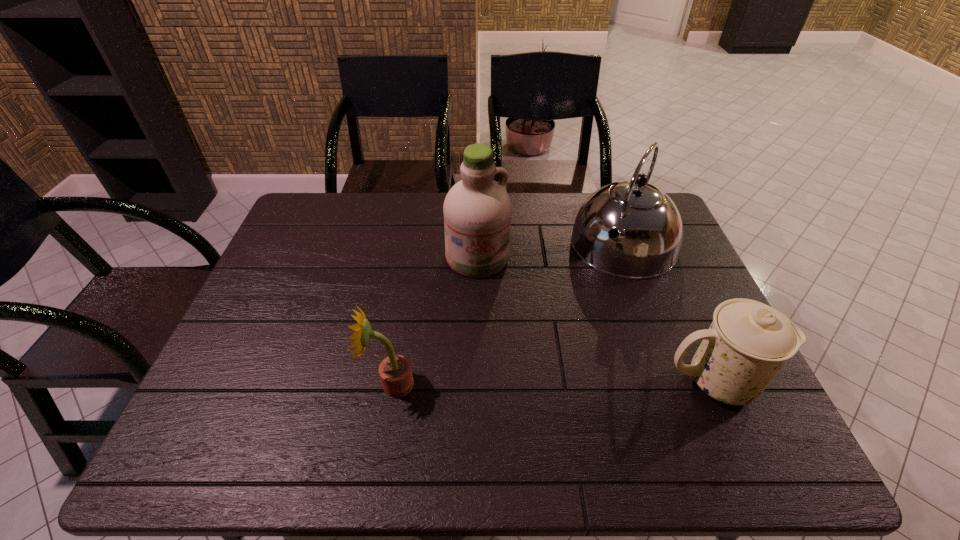
In order to click on empty location between the leftmost object and the chinaware in this screenshot , I will do tap(553, 383).

Where is `free space between the kettle and the third object from right to left`? This screenshot has height=540, width=960. free space between the kettle and the third object from right to left is located at coordinates (550, 251).

Image resolution: width=960 pixels, height=540 pixels. Find the location of `empty space between the kettle and the leftmost object`. empty space between the kettle and the leftmost object is located at coordinates (508, 314).

You are a GUI agent. You are given a task and a screenshot of the screen. Output one action in this format:
    pyautogui.click(x=<x>, y=<y>)
    Task: Click on the vacant point located between the chinaware and the leftmost object
    Image resolution: width=960 pixels, height=540 pixels.
    Given the screenshot: What is the action you would take?
    pyautogui.click(x=553, y=383)

Identify which object is the nearest to the chinaware. Please provide its 2D coordinates. Your answer should be formatted as a tuple, i.e. [(x, y)], where the tuple contains the x and y coordinates of a point satisfying the conditions above.

[(650, 227)]

Where is `object that is the third nearest to the leftmost object`? This screenshot has width=960, height=540. object that is the third nearest to the leftmost object is located at coordinates (748, 342).

Where is `free location that satisfies the following two spatial constraints: 1. on the front side of the chinaware; 2. on the spout of the cleansing agent`? free location that satisfies the following two spatial constraints: 1. on the front side of the chinaware; 2. on the spout of the cleansing agent is located at coordinates (476, 382).

Find the location of a particular element. This screenshot has height=540, width=960. vacant region that satisfies the following two spatial constraints: 1. on the front side of the kettle; 2. on the spout of the chinaware is located at coordinates (674, 382).